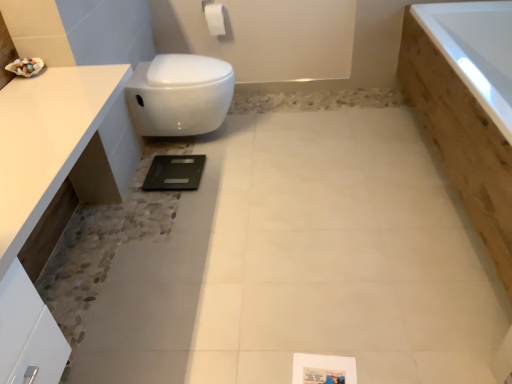
Question: Is white matte toilet paper at upper center inside the boundaries of white glossy countertop at upper left, or outside?

Choices:
 (A) inside
 (B) outside

Answer: (B)

Question: Based on their positions, is white matte toilet paper at upper center located to the left or right of white glossy countertop at upper left?

Choices:
 (A) left
 (B) right

Answer: (B)

Question: Which of these objects is positioned closest to the white matte toilet paper at upper center?

Choices:
 (A) white glossy countertop at upper left
 (B) white glossy toilet at upper left
 (C) wooden bathtub at right

Answer: (B)

Question: Which object is the farthest from the white glossy countertop at upper left?

Choices:
 (A) white glossy toilet at upper left
 (B) white matte toilet paper at upper center
 (C) wooden bathtub at right

Answer: (B)